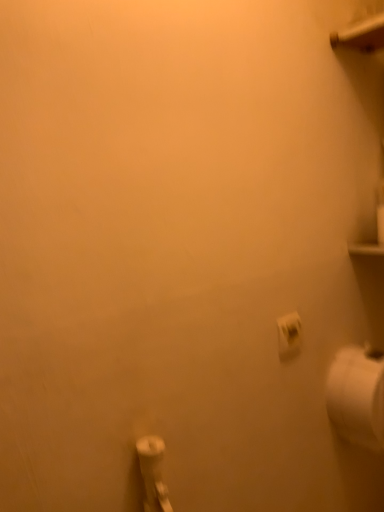
Question: Considering the positions of point (299, 346) and point (349, 400), is point (299, 346) closer or farther from the camera than point (349, 400)?

Choices:
 (A) farther
 (B) closer

Answer: (B)

Question: Is white matte toilet paper at lower right, the second toilet paper ordered from the bottom, taller or shorter than white matte toilet paper at right, placed as the second toilet paper when sorted from front to back?

Choices:
 (A) short
 (B) tall

Answer: (A)

Question: Considering the positions of white matte toilet paper at lower right, acting as the 1th toilet paper starting from the top, and white matte toilet paper at right, arranged as the first toilet paper when viewed from the back, in the image, is white matte toilet paper at lower right, acting as the 1th toilet paper starting from the top, wider or thinner than white matte toilet paper at right, arranged as the first toilet paper when viewed from the back,?

Choices:
 (A) thin
 (B) wide

Answer: (A)

Question: In the image, is white matte toilet paper at right, arranged as the first toilet paper when viewed from the back, positioned in front of or behind white matte toilet paper at lower right, which is the first toilet paper from front to back?

Choices:
 (A) behind
 (B) front

Answer: (A)

Question: Is white matte toilet paper at right, placed as the second toilet paper when sorted from front to back, inside the boundaries of white matte toilet paper at lower right, the second toilet paper in the right-to-left sequence, or outside?

Choices:
 (A) inside
 (B) outside

Answer: (B)

Question: Considering the positions of white matte toilet paper at right, the 1th toilet paper when ordered from right to left, and white matte toilet paper at lower right, marked as the 1th toilet paper in a left-to-right arrangement, in the image, is white matte toilet paper at right, the 1th toilet paper when ordered from right to left, bigger or smaller than white matte toilet paper at lower right, marked as the 1th toilet paper in a left-to-right arrangement,?

Choices:
 (A) small
 (B) big

Answer: (B)

Question: From their relative heights in the image, would you say white matte toilet paper at right, which is counted as the first toilet paper, starting from the bottom, is taller or shorter than white matte toilet paper at lower right, which is the first toilet paper from front to back?

Choices:
 (A) short
 (B) tall

Answer: (B)